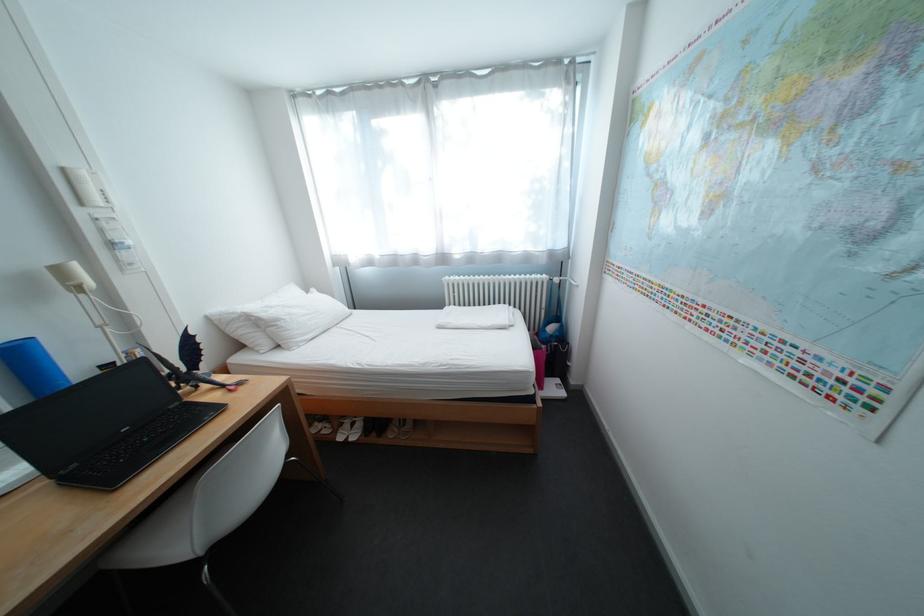
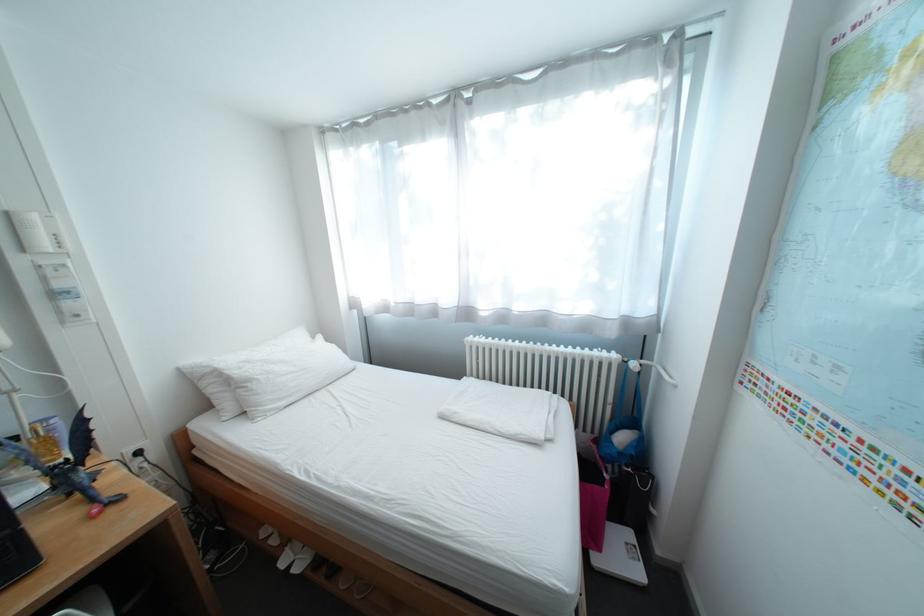
Question: The camera is either moving clockwise (left) or counter-clockwise (right) around the object. The first image is from the beginning of the video and the second image is from the end. Is the camera moving left or right when shooting the video?

Choices:
 (A) Left
 (B) Right

Answer: (B)